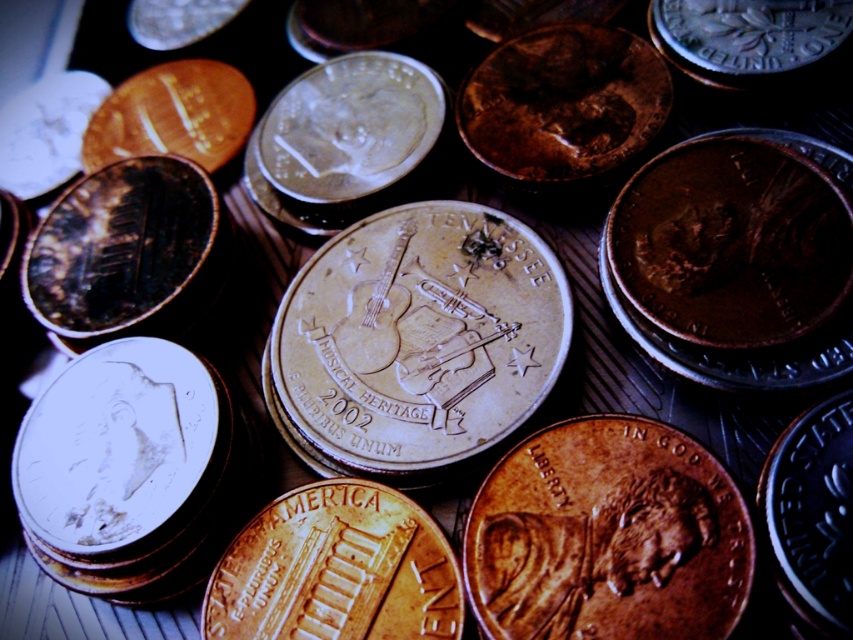
Is brown copper penny at center to the left of gold-plated copper penny at center from the viewer's perspective?

In fact, brown copper penny at center is to the right of gold-plated copper penny at center.

Does brown copper penny at center appear over gold-plated copper penny at center?

Indeed, brown copper penny at center is positioned over gold-plated copper penny at center.

What do you see at coordinates (608, 536) in the screenshot? The height and width of the screenshot is (640, 853). I see `brown copper penny at center` at bounding box center [608, 536].

Locate an element on the screen. brown copper penny at center is located at coordinates (608, 536).

Between brass/bronze coin at upper left and shiny copper penny at center, which one has more height?

brass/bronze coin at upper left is taller.

Does brass/bronze coin at upper left have a smaller size compared to shiny copper penny at center?

Incorrect, brass/bronze coin at upper left is not smaller in size than shiny copper penny at center.

You are a GUI agent. You are given a task and a screenshot of the screen. Output one action in this format:
    pyautogui.click(x=<x>, y=<y>)
    Task: Click on the brass/bronze coin at upper left
    
    Given the screenshot: What is the action you would take?
    pyautogui.click(x=119, y=244)

Does rusty copper penny at center appear on the left side of brass/bronze coin at upper left?

No, rusty copper penny at center is not to the left of brass/bronze coin at upper left.

Locate an element on the screen. The width and height of the screenshot is (853, 640). rusty copper penny at center is located at coordinates (x=563, y=102).